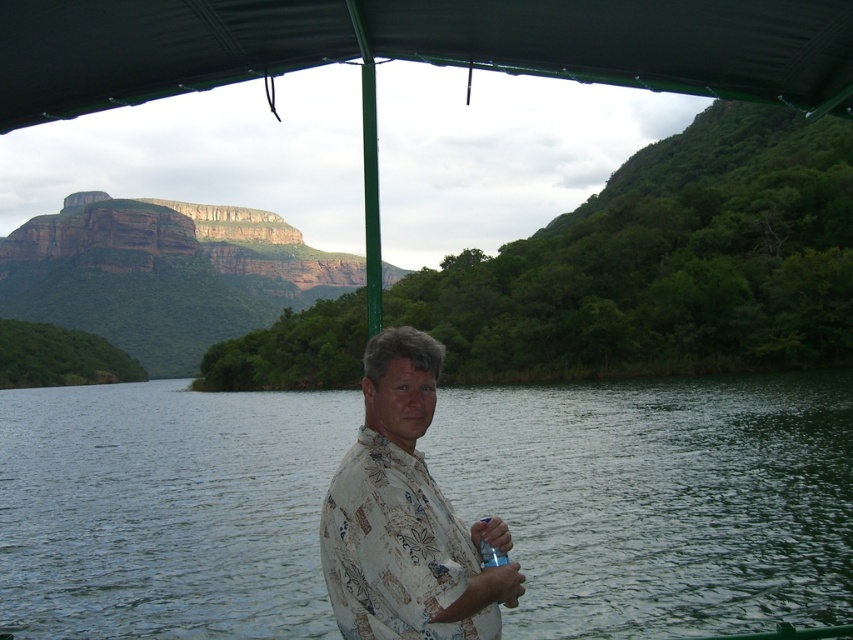
Question: Estimate the real-world distances between objects in this image. Which object is farther from the dark green fabric canopy at upper center?

Choices:
 (A) green liquid water at center
 (B) floral print shirt at center

Answer: (A)

Question: Which of the following is the closest to the observer?

Choices:
 (A) 114,416
 (B) 173,72
 (C) 328,532

Answer: (C)

Question: Can you confirm if dark green fabric canopy at upper center is positioned to the right of floral print shirt at center?

Choices:
 (A) no
 (B) yes

Answer: (A)

Question: Is dark green fabric canopy at upper center wider than floral print shirt at center?

Choices:
 (A) yes
 (B) no

Answer: (A)

Question: Does green liquid water at center appear on the left side of dark green fabric canopy at upper center?

Choices:
 (A) no
 (B) yes

Answer: (A)

Question: Among these points, which one is farthest from the camera?

Choices:
 (A) (415, 493)
 (B) (152, 593)

Answer: (B)